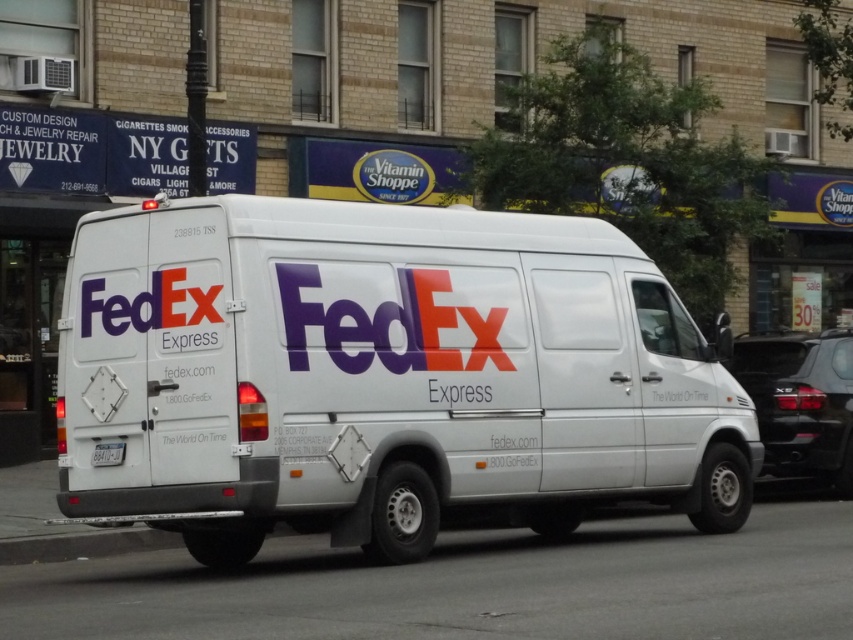
Is black glossy suv at right to the left of white plastic license plate at rear from the viewer's perspective?

No, black glossy suv at right is not to the left of white plastic license plate at rear.

Does black glossy suv at right appear over white plastic license plate at rear?

Indeed, black glossy suv at right is positioned over white plastic license plate at rear.

Locate an element on the screen. The height and width of the screenshot is (640, 853). black glossy suv at right is located at coordinates (799, 401).

Who is lower down, white matte fedex van at center or white plastic license plate at rear?

white matte fedex van at center is lower down.

Which is above, white matte fedex van at center or white plastic license plate at rear?

white plastic license plate at rear is above.

Does point (310, 452) lie behind point (106, 452)?

No, it is in front of (106, 452).

The width and height of the screenshot is (853, 640). I want to click on white matte fedex van at center, so coord(381,374).

Between white matte fedex van at center and black glossy suv at right, which one has less height?

Standing shorter between the two is white matte fedex van at center.

Measure the distance between white matte fedex van at center and black glossy suv at right.

white matte fedex van at center and black glossy suv at right are 6.16 meters apart from each other.

Between point (399, 257) and point (780, 440), which one is positioned in front?

Point (399, 257) is more forward.

Image resolution: width=853 pixels, height=640 pixels. What are the coordinates of `white matte fedex van at center` in the screenshot? It's located at (381, 374).